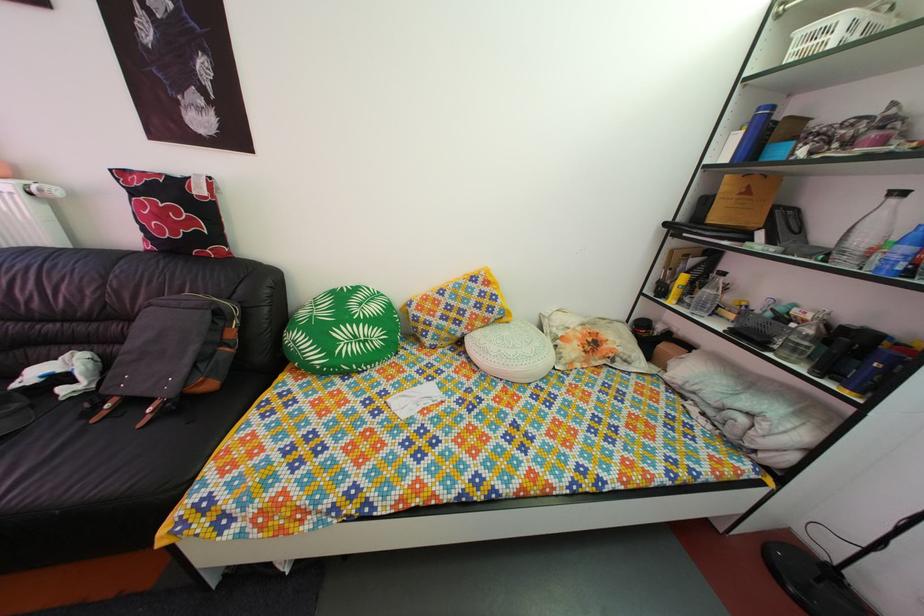
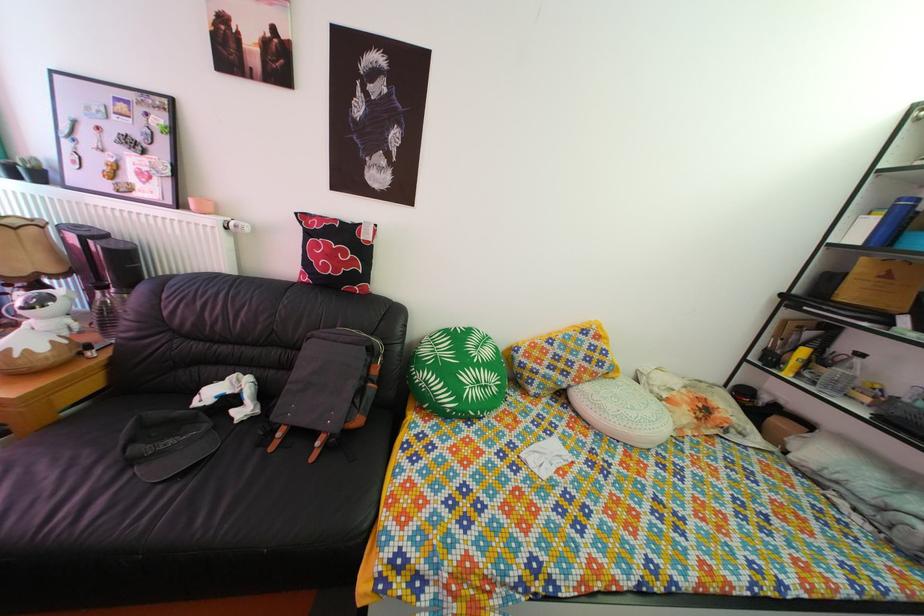
Find the pixel in the second image that matches point (446, 302) in the first image.

(555, 351)